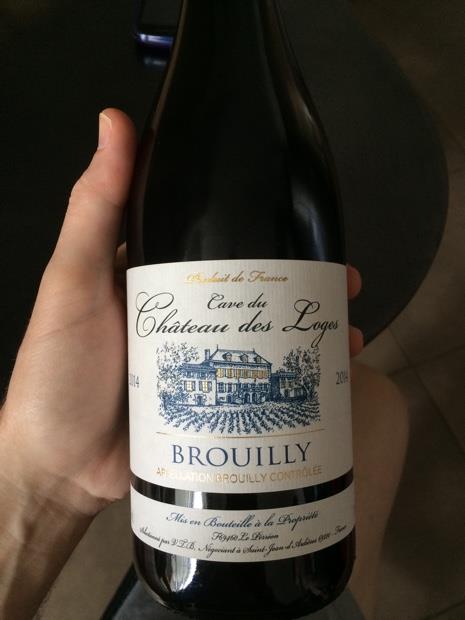
The width and height of the screenshot is (465, 620). What are the coordinates of `glass bottle` in the screenshot? It's located at (251, 192).